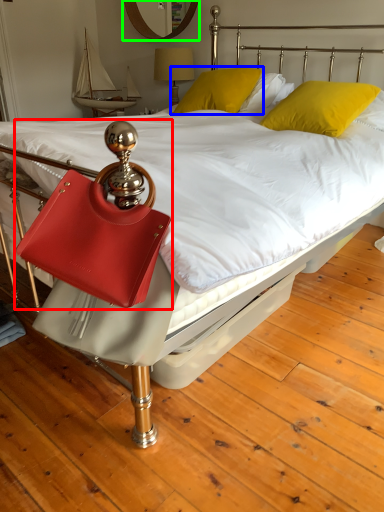
Question: Which is nearer to the handbag (highlighted by a red box)? pillow (highlighted by a blue box) or mirror (highlighted by a green box).

Choices:
 (A) pillow
 (B) mirror

Answer: (A)